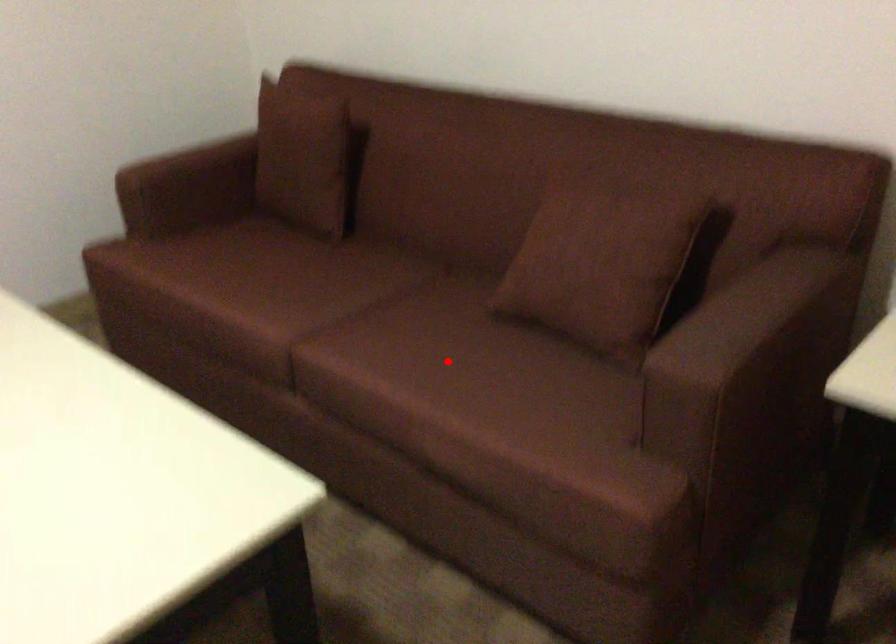
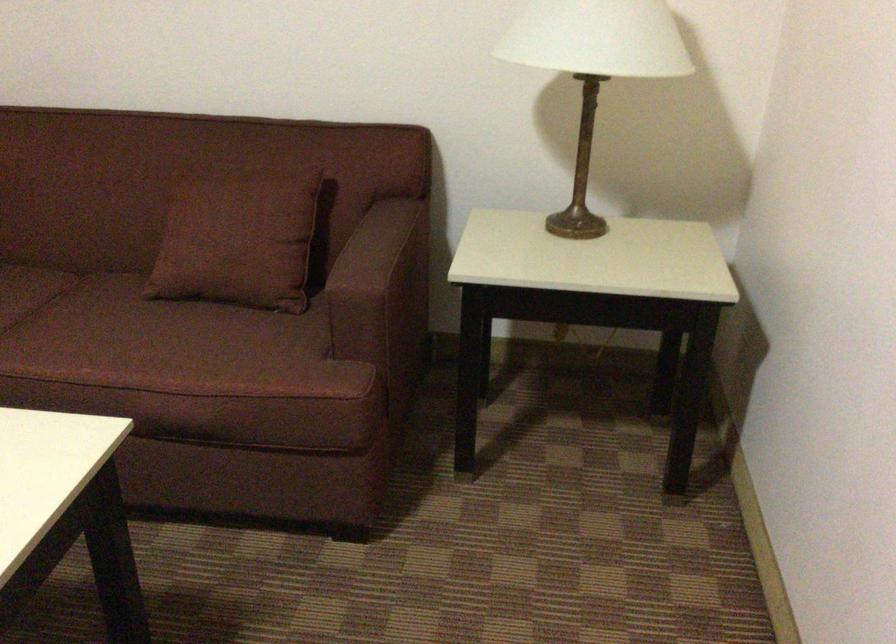
Where in the second image is the point corresponding to the highlighted location from the first image?

(135, 339)